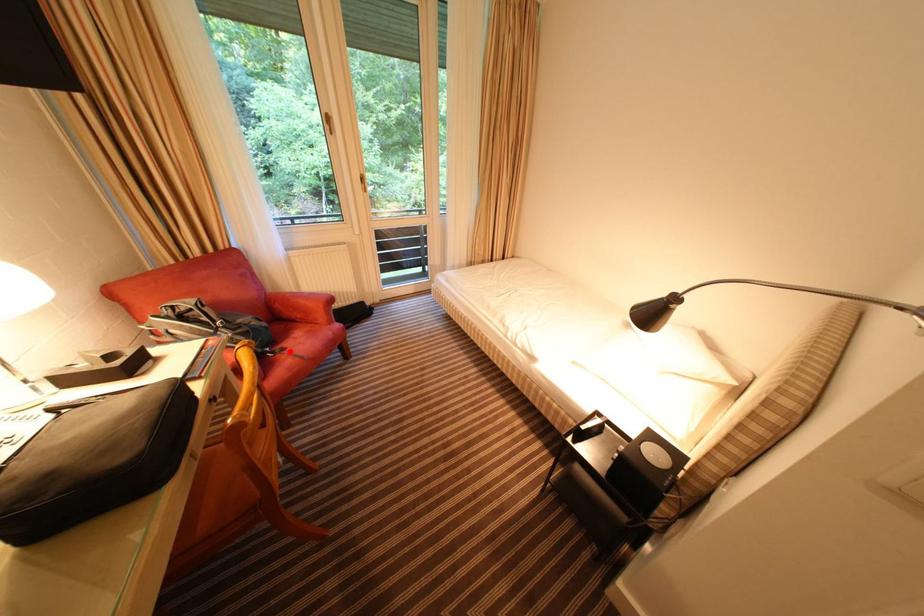
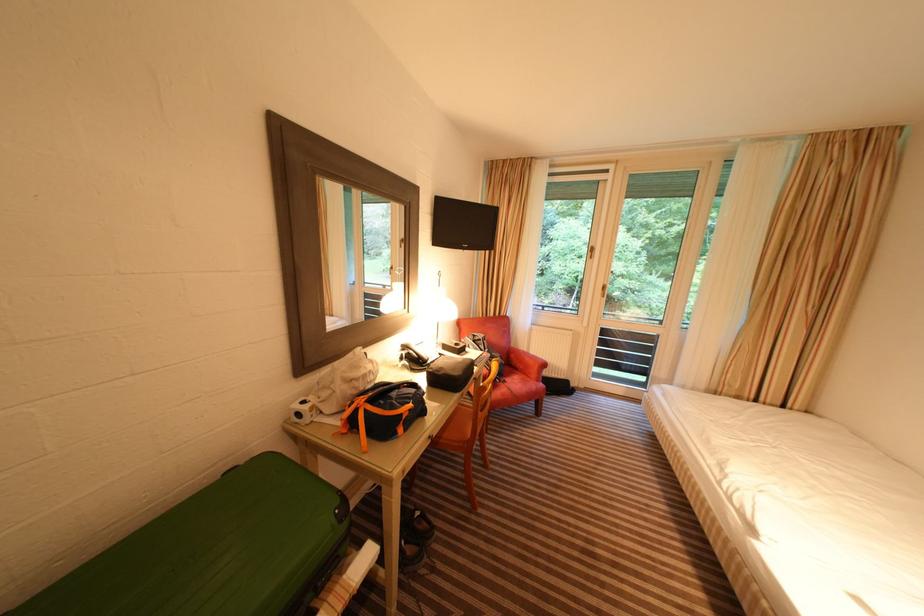
Question: I am providing you with two images of the same scene from different viewpoints. A red point is shown in image1. For the corresponding object point in image2, is it positioned nearer or farther from the camera?

Choices:
 (A) Nearer
 (B) Farther

Answer: (B)